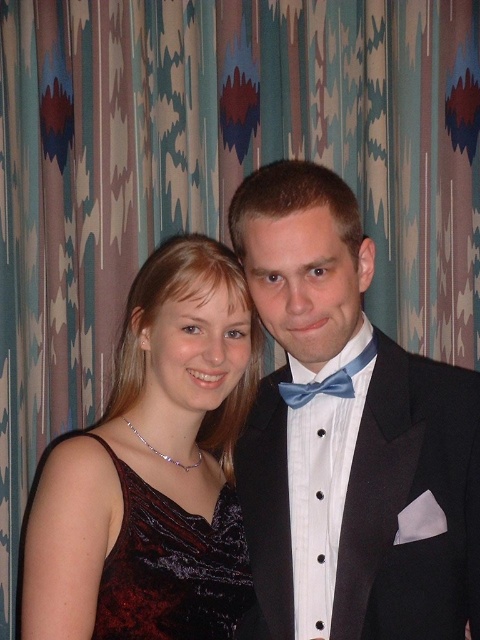
You are a photographer setting up for a photoshoot. The scene requires the satin black suit at center to be visible, but you need to ensure the velvet dress at left is also partially visible. Based on their current positions, is this possible?

The satin black suit at center is positioned over the velvet dress at left, which means the suit is in front of the dress. Therefore, only parts of the velvet dress at left might be visible where the suit does not cover it. This setup allows partial visibility of both items as required.

You are a photographer setting up a shoot. You need to position a light source so that it illuminates both the velvet dress at left and the velvet dark red dress at center adequately. Given their height difference, where should you place the light to ensure both are well lit without creating harsh shadows?

The velvet dress at left is taller than the velvet dark red dress at center, so placing the light source slightly above and between them will ensure both receive even illumination, avoiding harsh shadows by angling the light to cover the height difference.